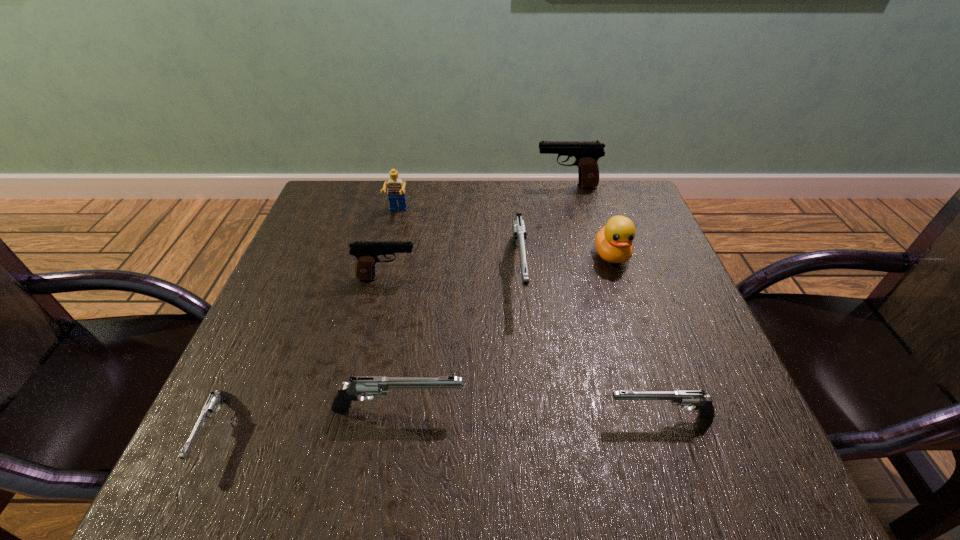
Identify the location of the second silver pistol from left to right. (359, 385).

Where is `the fifth tallest pistol`? Image resolution: width=960 pixels, height=540 pixels. the fifth tallest pistol is located at coordinates (703, 404).

At what (x,y) coordinates should I click in order to perform the action: click on the third biggest silver pistol. Please return your answer as a coordinate pair (x, y). The image size is (960, 540). Looking at the image, I should click on (703, 404).

You are a GUI agent. You are given a task and a screenshot of the screen. Output one action in this format:
    pyautogui.click(x=<x>, y=<y>)
    Task: Click on the shortest pistol
    This screenshot has height=540, width=960.
    Given the screenshot: What is the action you would take?
    pyautogui.click(x=219, y=397)

Identify the location of the leftmost silver pistol. The width and height of the screenshot is (960, 540). (219, 397).

Find the location of a particular element. This screenshot has height=540, width=960. vacant position located 0.050m at the barrel of the tallest pistol is located at coordinates (518, 186).

Identify the location of vacant area located 0.160m at the barrel of the tallest pistol. The width and height of the screenshot is (960, 540). (480, 186).

You are a GUI agent. You are given a task and a screenshot of the screen. Output one action in this format:
    pyautogui.click(x=<x>, y=<y>)
    Task: Click on the free space located 0.190m at the barrel of the tallest pistol
    Image resolution: width=960 pixels, height=540 pixels.
    Given the screenshot: What is the action you would take?
    pyautogui.click(x=469, y=186)

Where is `vacant space located on the face of the seventh nearest object`? Image resolution: width=960 pixels, height=540 pixels. vacant space located on the face of the seventh nearest object is located at coordinates (368, 338).

I want to click on vacant position located on the face of the yellow duckling, so click(x=646, y=358).